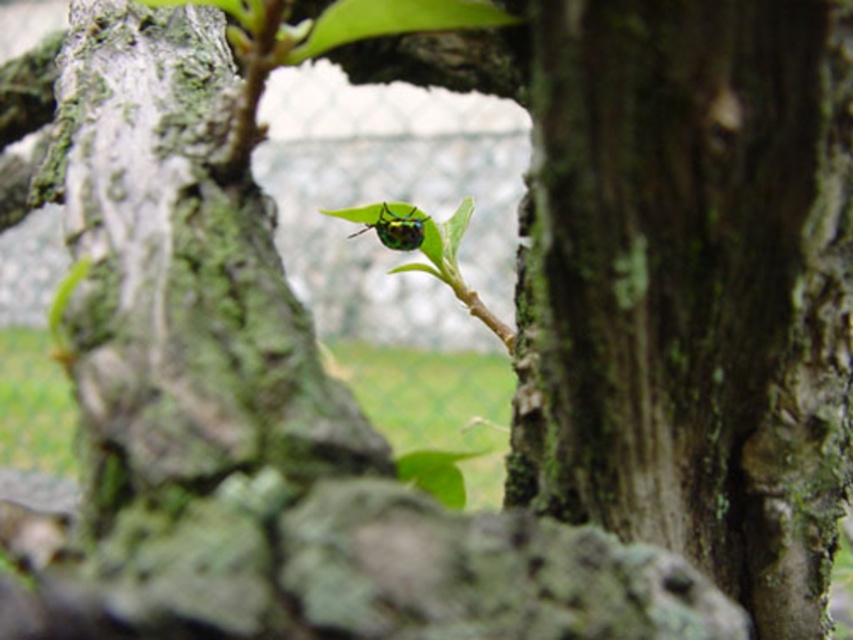
Question: Is green mossy bark at center bigger than metallic green beetle at center?

Choices:
 (A) yes
 (B) no

Answer: (A)

Question: Is green mossy bark at center positioned before metallic green beetle at center?

Choices:
 (A) no
 (B) yes

Answer: (B)

Question: Which object is farther from the camera taking this photo?

Choices:
 (A) metallic green beetle at center
 (B) green mossy bark at center

Answer: (A)

Question: Is green mossy bark at center wider than metallic green beetle at center?

Choices:
 (A) no
 (B) yes

Answer: (B)